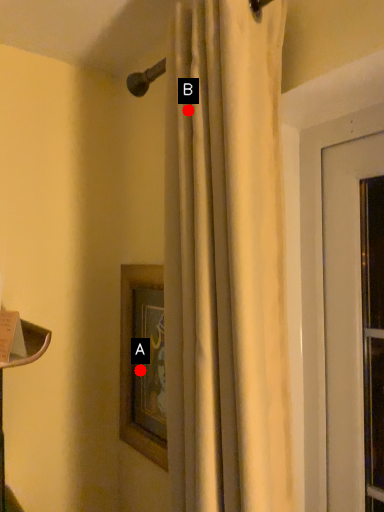
Question: Two points are circled on the image, labeled by A and B beside each circle. Which point is closer to the camera?

Choices:
 (A) A is closer
 (B) B is closer

Answer: (B)